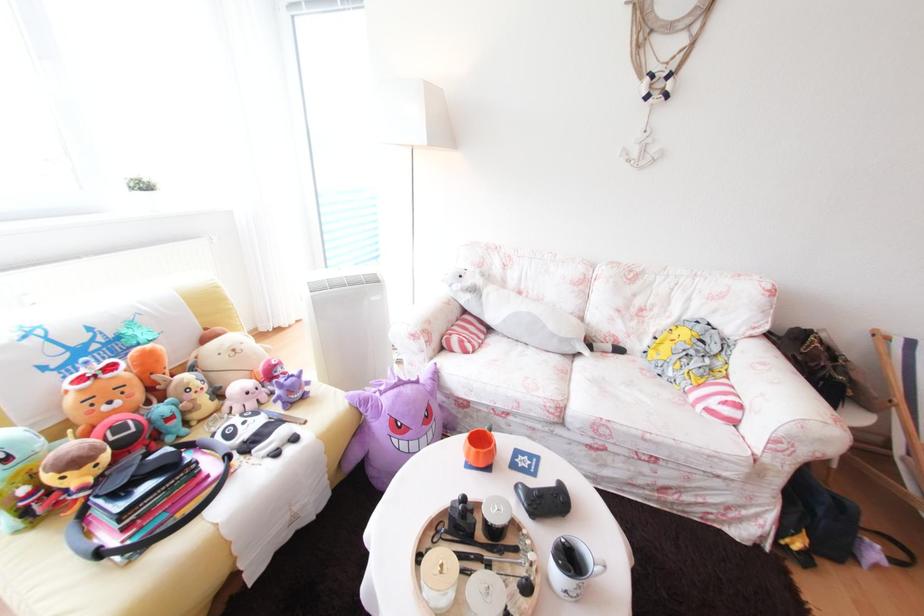
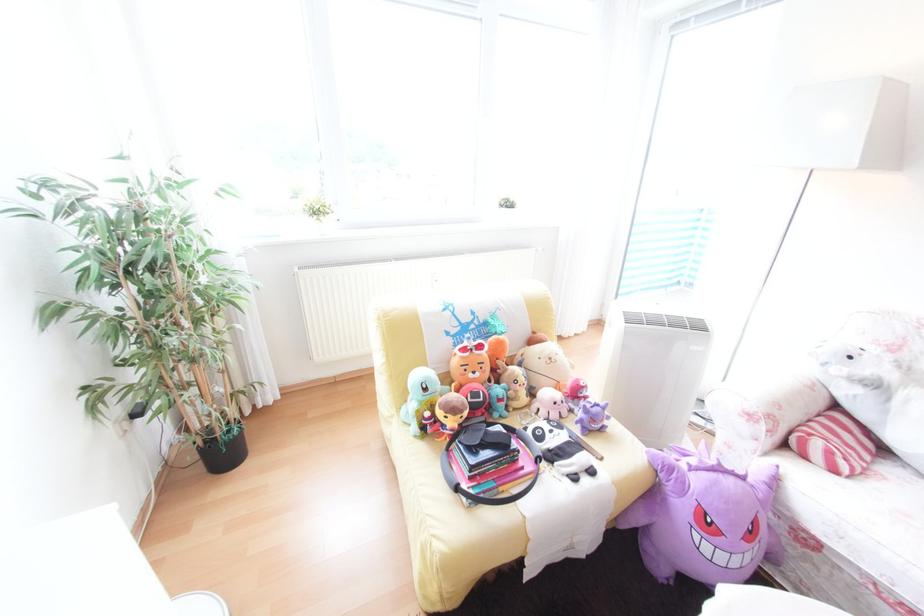
Find the pixel in the second image that matches [394,392] in the first image.

(706, 469)